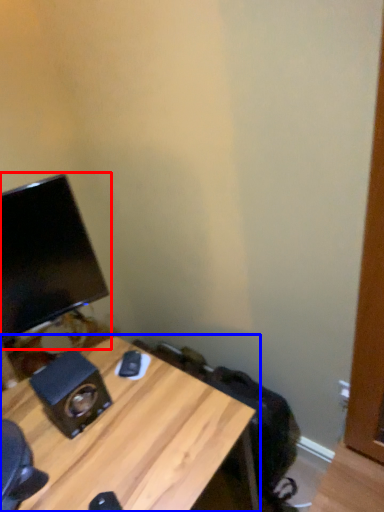
Question: Which of the following is the farthest to the observer, computer monitor (highlighted by a red box) or desk (highlighted by a blue box)?

Choices:
 (A) computer monitor
 (B) desk

Answer: (A)